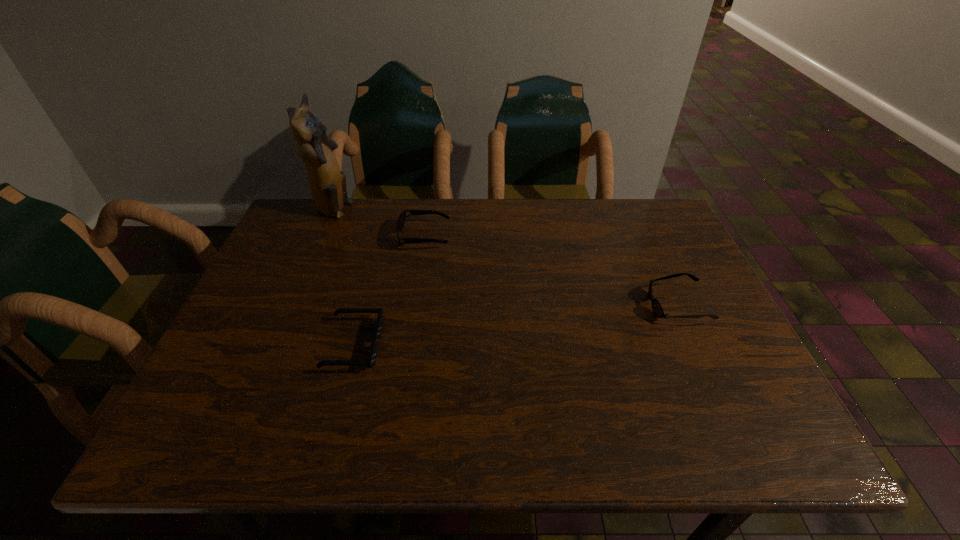
This screenshot has height=540, width=960. I want to click on free space at the near left corner of the desktop, so click(237, 420).

Find the location of a particular element. The image size is (960, 540). free region at the far right corner of the desktop is located at coordinates (655, 211).

Where is `free space at the near right corner`? The image size is (960, 540). free space at the near right corner is located at coordinates (755, 444).

Image resolution: width=960 pixels, height=540 pixels. Identify the location of free spot between the rightmost object and the cat. (505, 258).

Find the location of `empty space between the rightmost sunglasses and the second farthest object`. empty space between the rightmost sunglasses and the second farthest object is located at coordinates (550, 271).

You are a GUI agent. You are given a task and a screenshot of the screen. Output one action in this format:
    pyautogui.click(x=<x>, y=<y>)
    Task: Click on the free space between the shortest sunglasses and the cat
    
    Given the screenshot: What is the action you would take?
    pyautogui.click(x=344, y=278)

The width and height of the screenshot is (960, 540). I want to click on unoccupied area between the leftmost object and the shortest sunglasses, so click(344, 278).

At what (x,y) coordinates should I click in order to perform the action: click on empty space between the shortest sunglasses and the rightmost sunglasses. Please return your answer as a coordinate pair (x, y). This screenshot has width=960, height=540. Looking at the image, I should click on (516, 325).

Identify the location of free spot between the rightmost sunglasses and the cat. The height and width of the screenshot is (540, 960). (505, 258).

You are a GUI agent. You are given a task and a screenshot of the screen. Output one action in this format:
    pyautogui.click(x=<x>, y=<y>)
    Task: Click on the vacant space in between the shortest sunglasses and the rightmost sunglasses
    This screenshot has height=540, width=960.
    Given the screenshot: What is the action you would take?
    pyautogui.click(x=516, y=325)